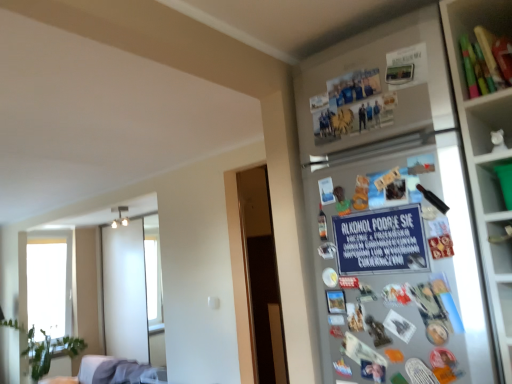
Question: Considering the relative positions of white fabric couch at lower left and green plastic container at upper right in the image provided, is white fabric couch at lower left to the left of green plastic container at upper right from the viewer's perspective?

Choices:
 (A) no
 (B) yes

Answer: (B)

Question: Can you confirm if white fabric couch at lower left is smaller than green plastic container at upper right?

Choices:
 (A) no
 (B) yes

Answer: (A)

Question: Is white fabric couch at lower left beside green plastic container at upper right?

Choices:
 (A) no
 (B) yes

Answer: (A)

Question: Does white fabric couch at lower left appear on the right side of green plastic container at upper right?

Choices:
 (A) no
 (B) yes

Answer: (A)

Question: Is white fabric couch at lower left outside green plastic container at upper right?

Choices:
 (A) yes
 (B) no

Answer: (A)

Question: From the image's perspective, does white fabric couch at lower left appear higher than green plastic container at upper right?

Choices:
 (A) no
 (B) yes

Answer: (A)

Question: Is white fabric couch at lower left taller than matte plastic utensils at upper right?

Choices:
 (A) yes
 (B) no

Answer: (A)

Question: Is white fabric couch at lower left oriented away from matte plastic utensils at upper right?

Choices:
 (A) yes
 (B) no

Answer: (B)

Question: From a real-world perspective, is white fabric couch at lower left positioned over matte plastic utensils at upper right based on gravity?

Choices:
 (A) no
 (B) yes

Answer: (A)

Question: Is white fabric couch at lower left smaller than matte plastic utensils at upper right?

Choices:
 (A) no
 (B) yes

Answer: (A)

Question: From the image's perspective, would you say white fabric couch at lower left is shown under matte plastic utensils at upper right?

Choices:
 (A) yes
 (B) no

Answer: (A)

Question: Is white fabric couch at lower left far away from matte plastic utensils at upper right?

Choices:
 (A) yes
 (B) no

Answer: (A)

Question: From the image's perspective, is blue paper sign at upper right beneath transparent glass window at left?

Choices:
 (A) no
 (B) yes

Answer: (A)